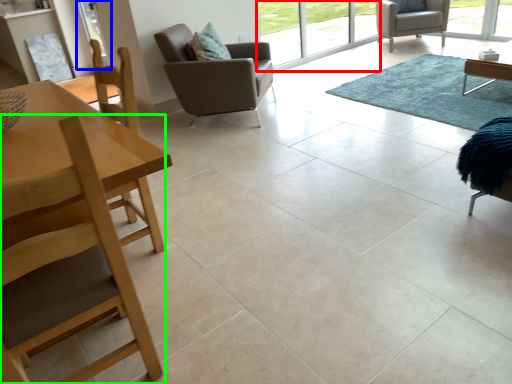
Question: Based on their relative distances, which object is farther from window screen (highlighted by a red box)? Choose from screen door (highlighted by a blue box) and chair (highlighted by a green box).

Choices:
 (A) screen door
 (B) chair

Answer: (B)